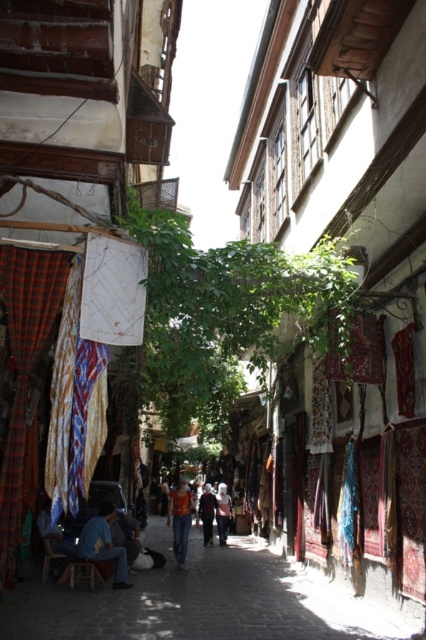
Does point (126, 586) come behind point (227, 518)?

No, (126, 586) is closer to viewer.

What do you see at coordinates (103, 545) in the screenshot? Image resolution: width=426 pixels, height=640 pixels. I see `blue denim jeans at lower left` at bounding box center [103, 545].

The image size is (426, 640). In order to click on blue denim jeans at lower left in this screenshot , I will do `click(103, 545)`.

Does plaid fabric curtain at left come in front of light pink fabric at center?

Yes, plaid fabric curtain at left is closer to the viewer.

Between plaid fabric curtain at left and light pink fabric at center, which one is positioned lower?

Positioned lower is light pink fabric at center.

Identify the location of plaid fabric curtain at left. (25, 358).

Is blue denim jeans at lower left thinner than dark blue fabric at center?

No.

Does blue denim jeans at lower left have a smaller size compared to dark blue fabric at center?

No, blue denim jeans at lower left is not smaller than dark blue fabric at center.

Which is in front, point (106, 515) or point (204, 522)?

Point (106, 515)

Where is `blue denim jeans at lower left`? The height and width of the screenshot is (640, 426). blue denim jeans at lower left is located at coordinates (103, 545).